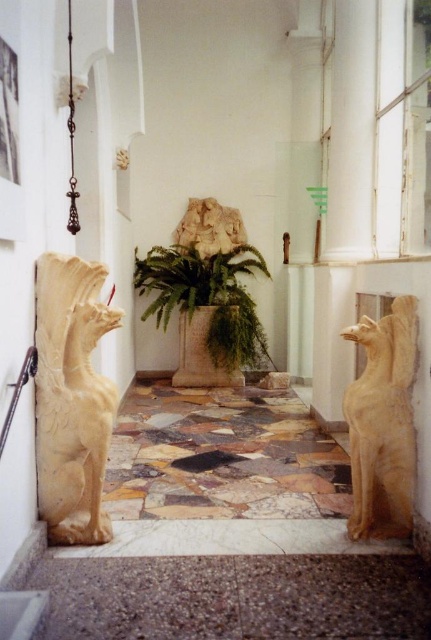
Question: Does white marble griffin at left have a smaller size compared to white marble lion at center?

Choices:
 (A) no
 (B) yes

Answer: (A)

Question: Does white marble griffin at left have a larger size compared to matte stone gargoyle at right?

Choices:
 (A) yes
 (B) no

Answer: (A)

Question: Which object is the farthest from the white marble lion at center?

Choices:
 (A) stone textured planter at center
 (B) green leafy fern at center

Answer: (A)

Question: Estimate the real-world distances between objects in this image. Which object is farther from the white marble griffin at left?

Choices:
 (A) white marble lion at center
 (B) stone textured planter at center
 (C) green leafy fern at center
 (D) matte stone gargoyle at right

Answer: (A)

Question: Which point is closer to the camera?

Choices:
 (A) (389, 497)
 (B) (221, 332)

Answer: (A)

Question: Can you confirm if white marble griffin at left is wider than stone textured planter at center?

Choices:
 (A) no
 (B) yes

Answer: (A)